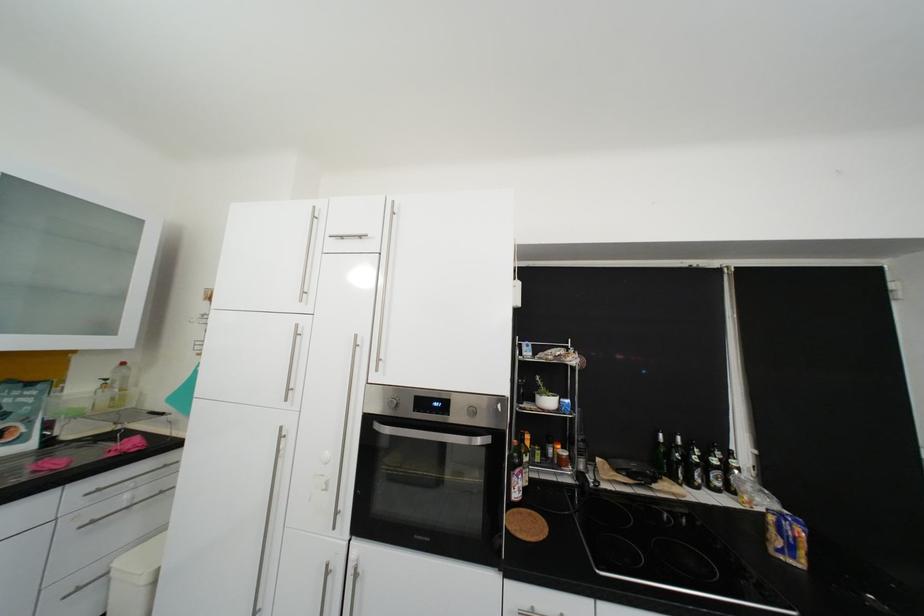
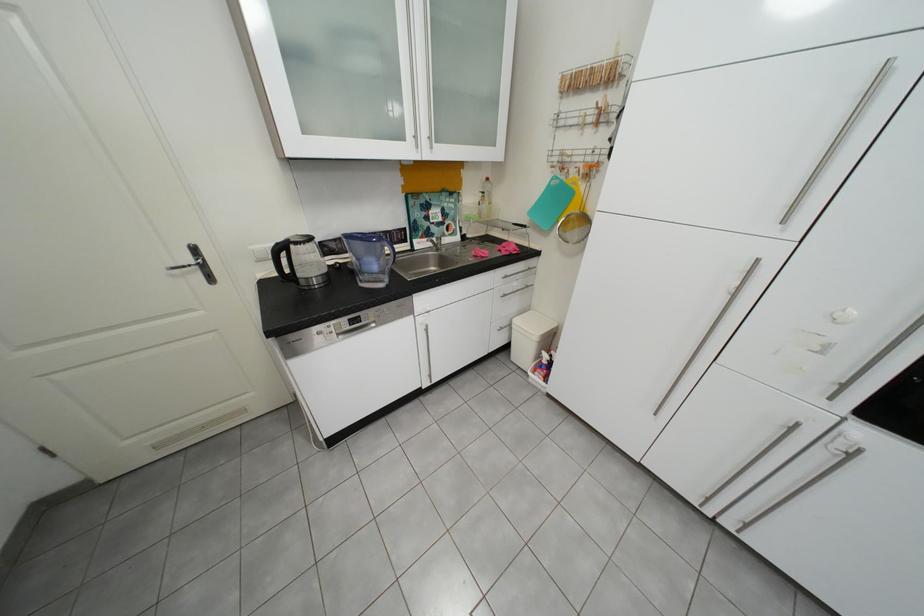
How did the camera likely rotate?

The camera's rotation is toward left-down.